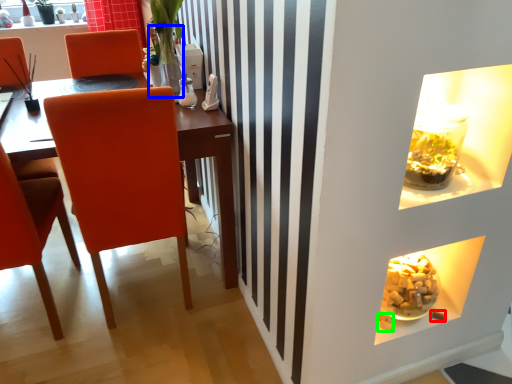
Question: Based on their relative distances, which object is nearer to food (highlighted by a red box)? Choose from glass vase (highlighted by a blue box) and food (highlighted by a green box).

Choices:
 (A) glass vase
 (B) food

Answer: (B)